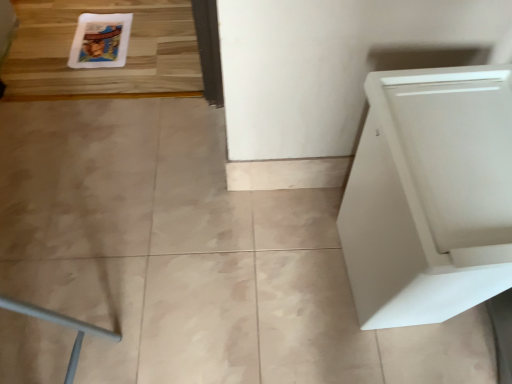
What are the coordinates of `vacant space in front of white matte cabinet at right` in the screenshot? It's located at (396, 360).